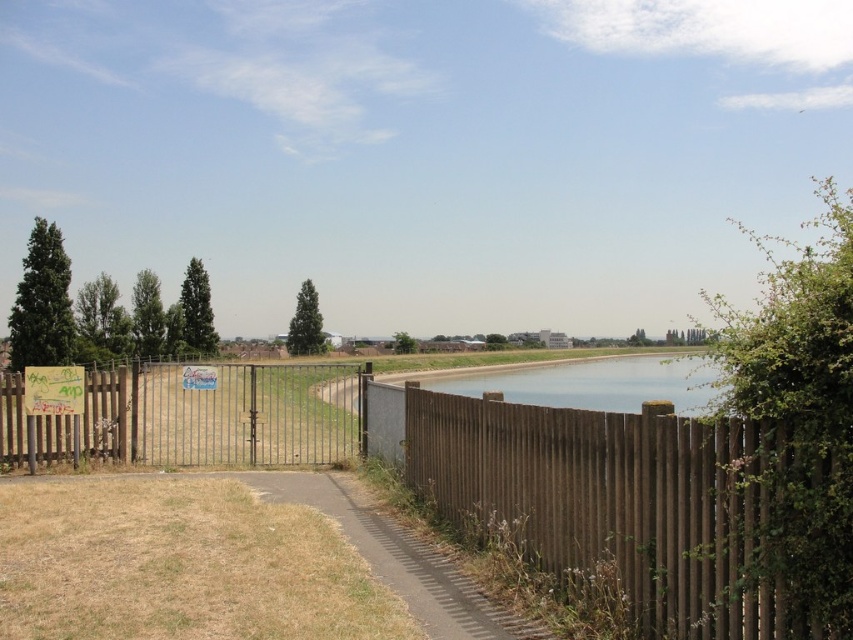
Question: From the image, what is the correct spatial relationship of brown textured path at lower center in relation to clear water at center?

Choices:
 (A) left
 (B) right

Answer: (A)

Question: Among these objects, which one is nearest to the camera?

Choices:
 (A) brown wooden fence at left
 (B) clear water at center
 (C) brown wooden fence at right
 (D) brown textured path at lower center

Answer: (C)

Question: Is brown wooden fence at right wider than brown wooden fence at left?

Choices:
 (A) no
 (B) yes

Answer: (A)

Question: Among these objects, which one is farthest from the camera?

Choices:
 (A) brown wooden fence at left
 (B) brown textured path at lower center

Answer: (A)

Question: Is brown wooden fence at right bigger than clear water at center?

Choices:
 (A) yes
 (B) no

Answer: (B)

Question: Which point appears farthest from the camera in this image?

Choices:
 (A) (399, 545)
 (B) (560, 403)
 (C) (283, 400)
 (D) (756, 602)

Answer: (B)